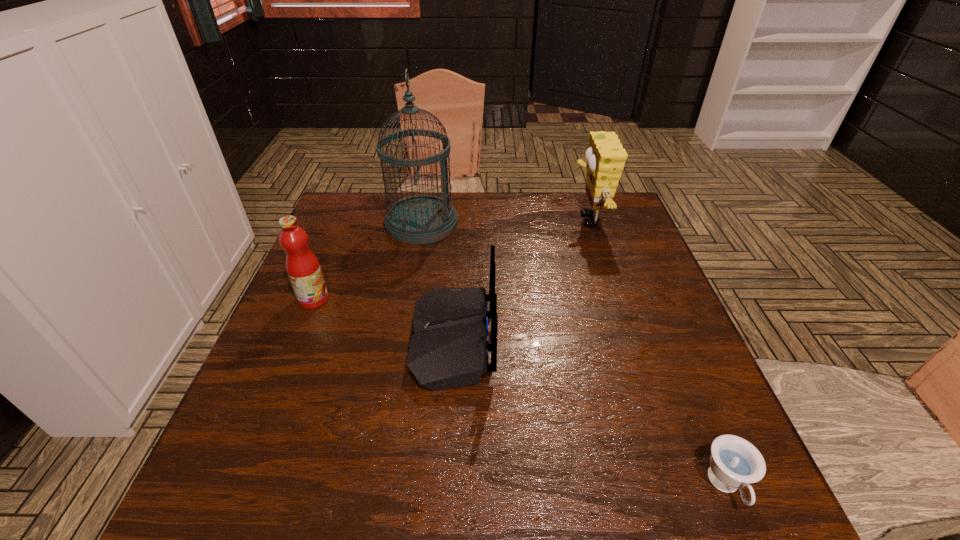
The height and width of the screenshot is (540, 960). In order to click on vacant region located 0.280m on the front label of the leftmost object in this screenshot , I will do `click(444, 299)`.

The width and height of the screenshot is (960, 540). In order to click on vacant region located 0.380m on the back of the router in this screenshot , I will do `click(668, 341)`.

Where is `birdcage that is positioned at the far edge`? This screenshot has height=540, width=960. birdcage that is positioned at the far edge is located at coordinates (418, 219).

The height and width of the screenshot is (540, 960). Find the location of `sponge that is at the far edge`. sponge that is at the far edge is located at coordinates (605, 156).

Identify the location of object positioned at the near edge. [734, 462].

Identify the location of object located at the left edge. (303, 268).

The image size is (960, 540). Identify the location of sponge that is positioned at the right edge. (605, 156).

Identify the location of teacup positioned at the right edge. (734, 462).

Where is `object at the far right corner`? object at the far right corner is located at coordinates (605, 156).

Find the location of a particular element. The image size is (960, 540). object located at the near right corner is located at coordinates (734, 462).